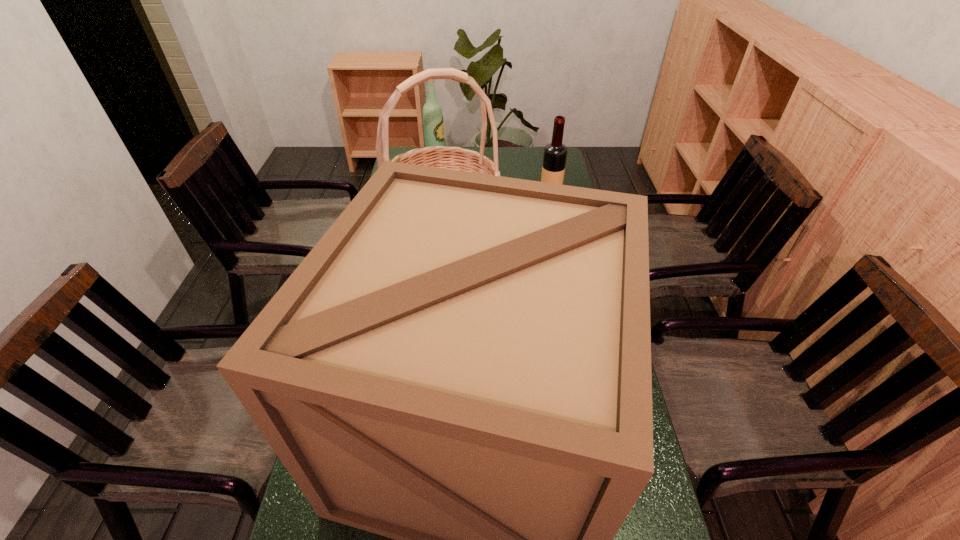
I want to click on the second nearest object, so click(x=455, y=158).

Identify the location of the farthest object. (433, 122).

Identify the location of the left wine bottle. This screenshot has height=540, width=960. (433, 122).

Find the location of a particular element. the right wine bottle is located at coordinates (555, 153).

Find the location of `the nearer wine bottle`. the nearer wine bottle is located at coordinates (555, 153).

You are a GUI agent. You are given a task and a screenshot of the screen. Output one action in this format:
    pyautogui.click(x=<x>, y=<y>)
    Task: Click on the free space located 0.200m on the front of the basket
    The width and height of the screenshot is (960, 540).
    Given the screenshot: What is the action you would take?
    pyautogui.click(x=435, y=328)

This screenshot has width=960, height=540. Identify the location of vacant space located 0.300m on the front-facing side of the farthest object. (514, 164).

Where is `vacant area situated on the front of the nearer wine bottle`? vacant area situated on the front of the nearer wine bottle is located at coordinates (561, 259).

At what (x,y) coordinates should I click in order to perform the action: click on object that is at the far edge. Please return your answer as a coordinate pair (x, y). The height and width of the screenshot is (540, 960). Looking at the image, I should click on (433, 122).

Find the location of a particular element. The height and width of the screenshot is (540, 960). basket situated at the left edge is located at coordinates (455, 158).